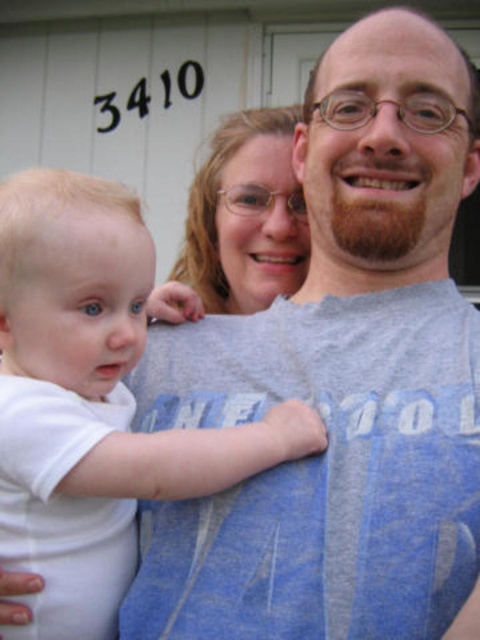
Question: Estimate the real-world distances between objects in this image. Which object is closer to the matte gray hair at center?

Choices:
 (A) white soft baby at center
 (B) gray cotton t-shirt at center

Answer: (B)

Question: Is white soft baby at center smaller than matte gray hair at center?

Choices:
 (A) no
 (B) yes

Answer: (B)

Question: Is white soft baby at center below matte gray hair at center?

Choices:
 (A) no
 (B) yes

Answer: (B)

Question: Among these objects, which one is nearest to the camera?

Choices:
 (A) gray cotton t-shirt at center
 (B) white soft baby at center
 (C) matte gray hair at center

Answer: (A)

Question: Can you confirm if gray cotton t-shirt at center is positioned above matte gray hair at center?

Choices:
 (A) yes
 (B) no

Answer: (B)

Question: Which point is closer to the camera?

Choices:
 (A) (220, 186)
 (B) (235, 444)

Answer: (B)